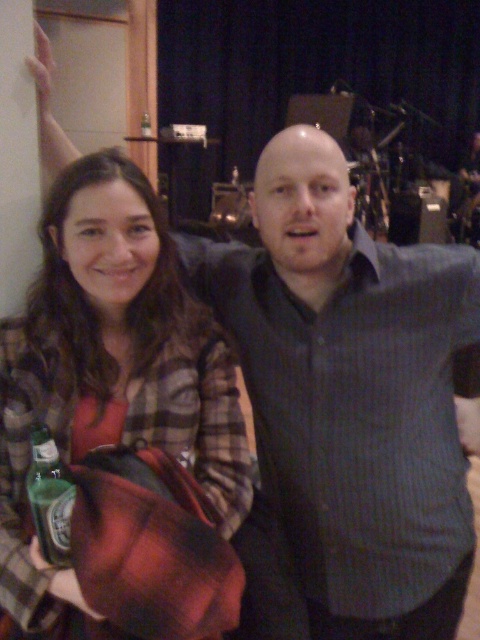
Is plaid flannel shirt at left thinner than green glass bottle at lower left?

No, plaid flannel shirt at left is not thinner than green glass bottle at lower left.

Is plaid flannel shirt at left smaller than green glass bottle at lower left?

→ Actually, plaid flannel shirt at left might be larger than green glass bottle at lower left.

Where is `plaid flannel shirt at left`? The height and width of the screenshot is (640, 480). plaid flannel shirt at left is located at coordinates (109, 369).